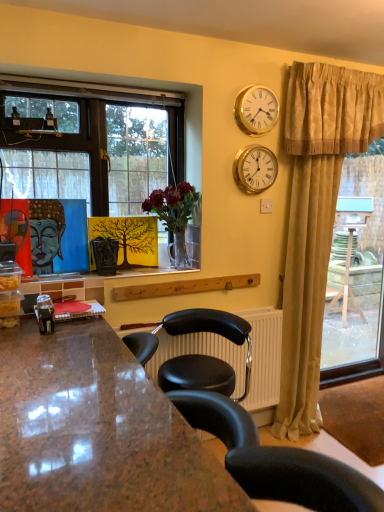
Question: Is matte blue buddha at left wider or thinner than marble countertop at lower left?

Choices:
 (A) thin
 (B) wide

Answer: (A)

Question: Considering the positions of matte blue buddha at left and marble countertop at lower left in the image, is matte blue buddha at left taller or shorter than marble countertop at lower left?

Choices:
 (A) short
 (B) tall

Answer: (A)

Question: Which of these objects is positioned farthest from the gold metallic clock at upper right, the 2th clock positioned from the bottom?

Choices:
 (A) beige fabric curtain at right
 (B) marble countertop at lower left
 (C) clear glass vase at center
 (D) gold metallic clock at upper right, which is the 2th clock from top to bottom
 (E) matte blue buddha at left

Answer: (B)

Question: Based on their relative distances, which object is farther from the clear glass vase at center?

Choices:
 (A) painted wood window sill at center
 (B) marble countertop at lower left
 (C) gold metallic clock at upper right, acting as the 1th clock starting from the top
 (D) matte blue buddha at left
 (E) beige fabric curtain at right

Answer: (B)